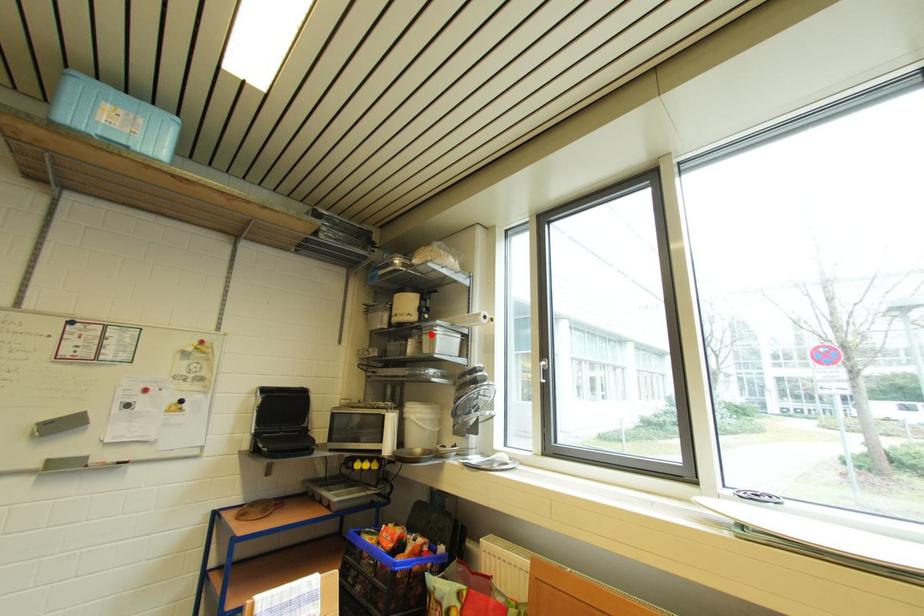
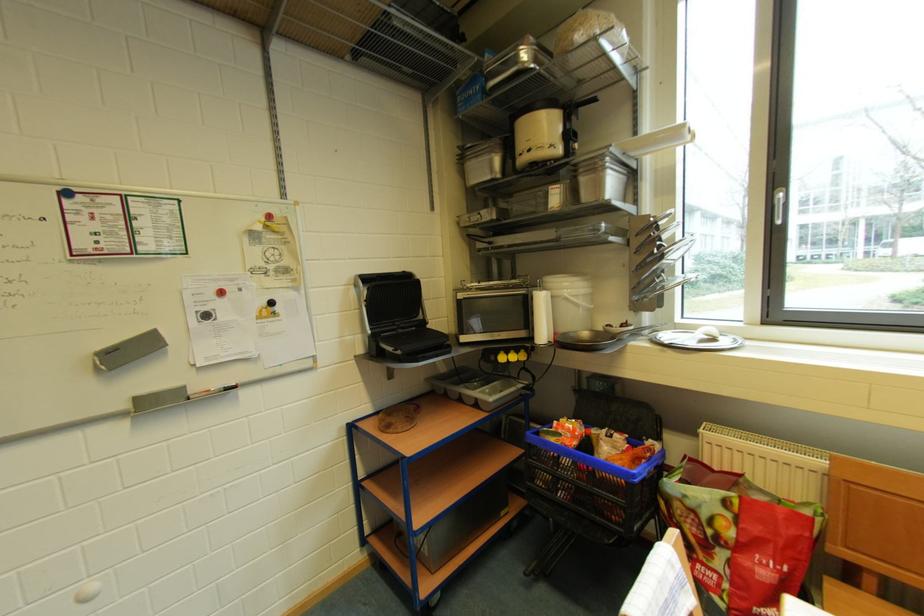
Find the pixel in the second image that matches the highlighted location in the first image.

(589, 174)